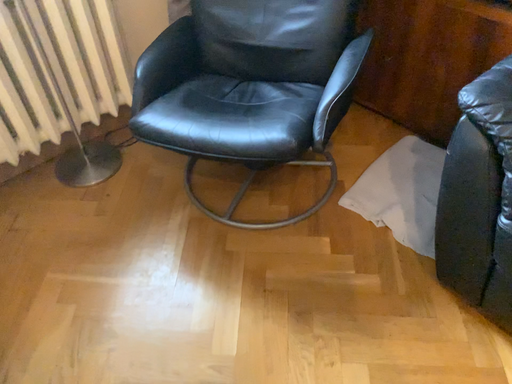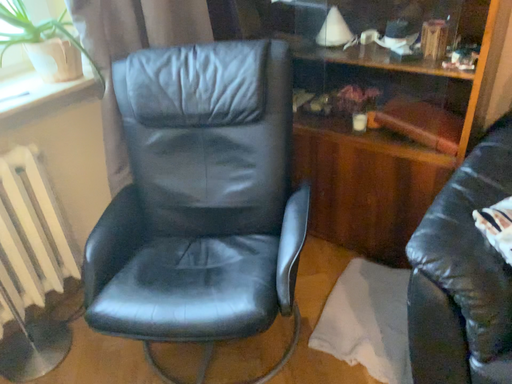
Question: How did the camera likely rotate when shooting the video?

Choices:
 (A) rotated downward
 (B) rotated upward

Answer: (B)